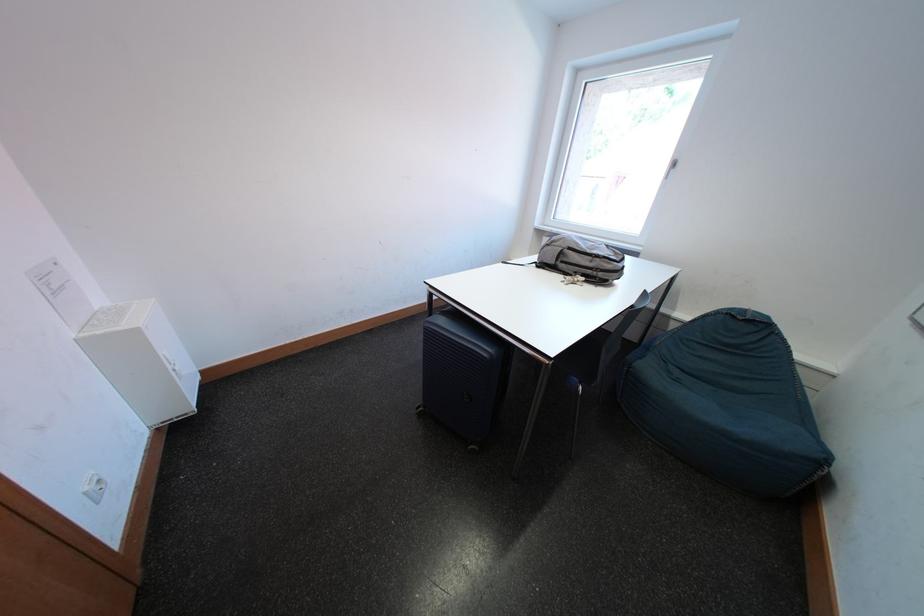
You are a GUI agent. You are given a task and a screenshot of the screen. Output one action in this format:
    pyautogui.click(x=<x>, y=<y>)
    Task: Click on the white window handle
    
    Given the screenshot: What is the action you would take?
    pyautogui.click(x=670, y=167)